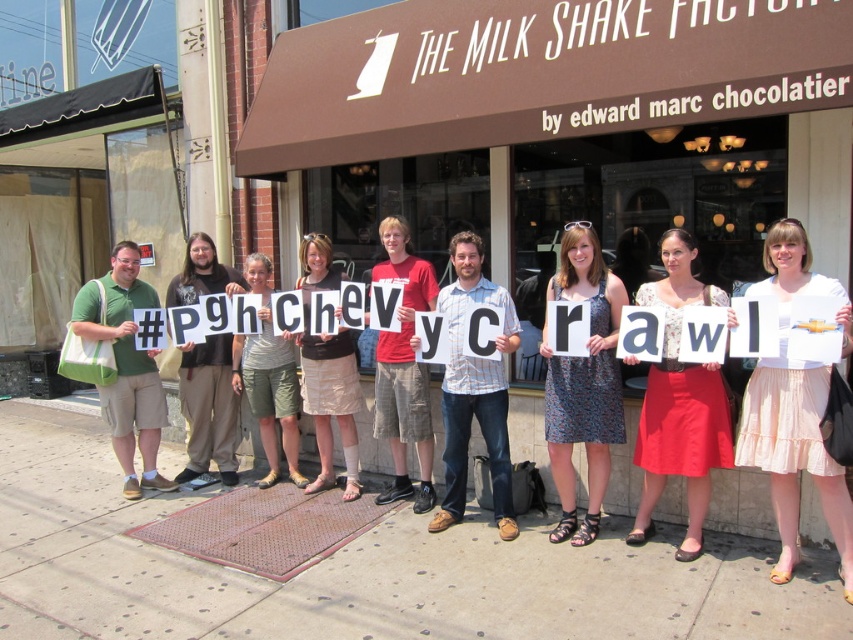
Question: Does pink cotton skirt at center appear under beige fabric skirt at center?

Choices:
 (A) yes
 (B) no

Answer: (A)

Question: Which point appears farthest from the camera in this image?

Choices:
 (A) (305, 348)
 (B) (253, 365)
 (C) (699, 445)
 (D) (809, 424)

Answer: (B)

Question: Which object is the closest to the khaki shorts at center?

Choices:
 (A) matte white dress at center
 (B) beige fabric skirt at center
 (C) pink cotton skirt at center
 (D) black cotton t-shirt at center

Answer: (B)

Question: Which point appears farthest from the camera in this image?

Choices:
 (A) coord(202,353)
 (B) coord(666,372)

Answer: (A)

Question: Does pink cotton skirt at center have a lesser width compared to printed fabric dress at center?

Choices:
 (A) no
 (B) yes

Answer: (A)

Question: Does matte white dress at center appear on the right side of black cotton t-shirt at center?

Choices:
 (A) yes
 (B) no

Answer: (A)